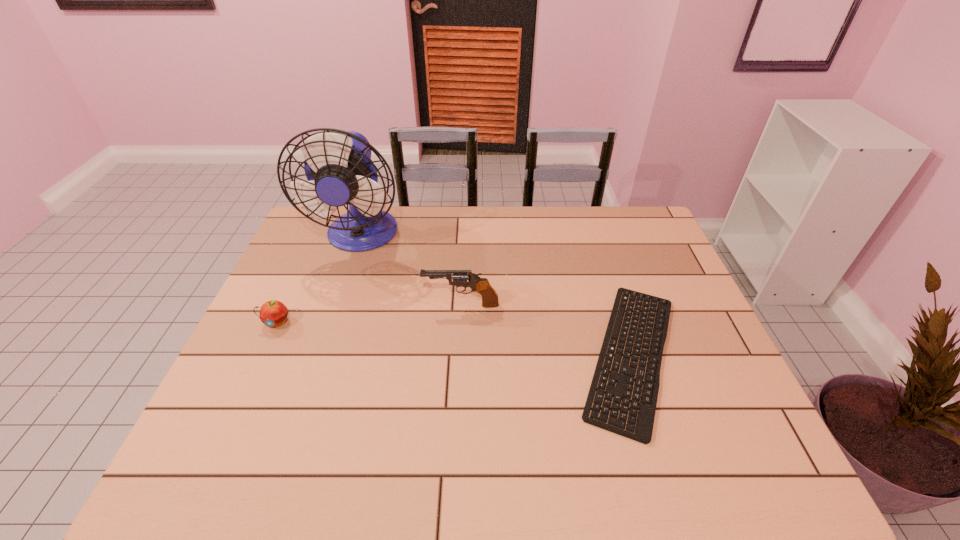
Find the location of a particular element. free space between the computer keyboard and the third object from left to right is located at coordinates point(546,330).

Locate an element on the screen. Image resolution: width=960 pixels, height=540 pixels. free area in between the apple and the fan is located at coordinates (319, 279).

In order to click on vacant space in between the third tallest object and the third object from left to right in this screenshot , I will do `click(369, 314)`.

At what (x,y) coordinates should I click in order to perform the action: click on free space between the second shortest object and the fan. Please return your answer as a coordinate pair (x, y). This screenshot has width=960, height=540. Looking at the image, I should click on (319, 279).

I want to click on vacant area that lies between the computer keyboard and the third tallest object, so click(454, 339).

The width and height of the screenshot is (960, 540). I want to click on unoccupied area between the computer keyboard and the third shortest object, so click(546, 330).

Locate an element on the screen. object identified as the closest to the fan is located at coordinates (482, 286).

This screenshot has height=540, width=960. What are the coordinates of `object that is the nearest to the second tallest object` in the screenshot? It's located at (338, 166).

This screenshot has height=540, width=960. What are the coordinates of `blank area in the image that satisfies the following two spatial constraints: 1. in front of the fan where the airflow is directed; 2. along the barrel of the gun` in the screenshot? It's located at (338, 305).

The image size is (960, 540). Find the location of `vacant space that satisfies the following two spatial constraints: 1. in front of the fan where the airflow is directed; 2. along the barrel of the third object from left to right`. vacant space that satisfies the following two spatial constraints: 1. in front of the fan where the airflow is directed; 2. along the barrel of the third object from left to right is located at coordinates (338, 305).